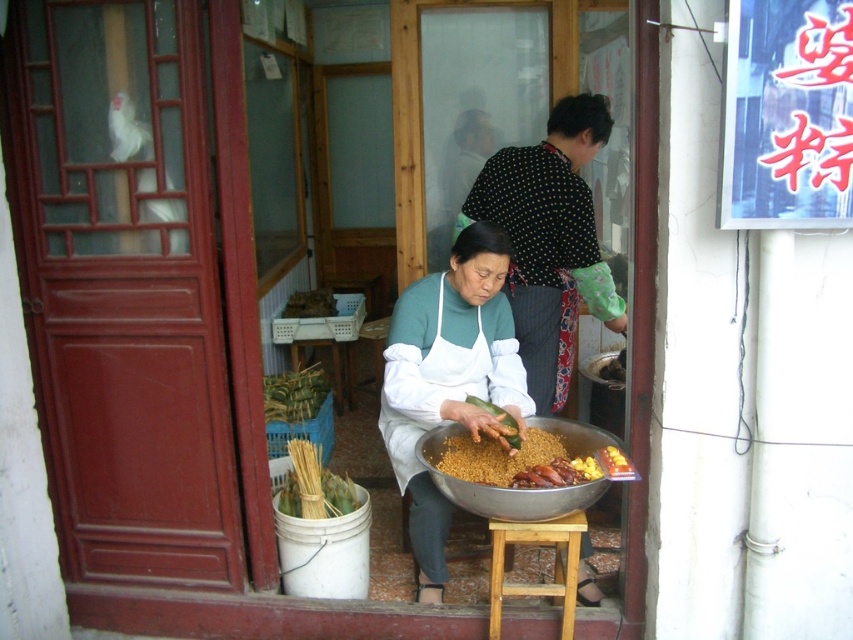
Question: Which of the following is the closest to the observer?

Choices:
 (A) (599, 461)
 (B) (608, 368)
 (C) (560, 600)

Answer: (A)

Question: Estimate the real-world distances between objects in this image. Which object is closer to the white matte apron at center?

Choices:
 (A) green leafy vegetable at center
 (B) green bamboo skewers at lower left
 (C) brown matte roasted duck at center
 (D) brown crispy food at center

Answer: (A)

Question: Is green bamboo skewers at lower left wider than green bamboo at center?

Choices:
 (A) yes
 (B) no

Answer: (B)

Question: From the image, what is the correct spatial relationship of brown matte bowl at center in relation to yellow matte food at center?

Choices:
 (A) above
 (B) below

Answer: (A)

Question: Which object is the closest to the green bamboo skewers at lower left?

Choices:
 (A) brown matte bowl at center
 (B) brown crispy food at center
 (C) green bamboo at center
 (D) white matte apron at center

Answer: (D)

Question: Can you confirm if green bamboo skewers at lower left is wider than yellow matte food at center?

Choices:
 (A) yes
 (B) no

Answer: (A)